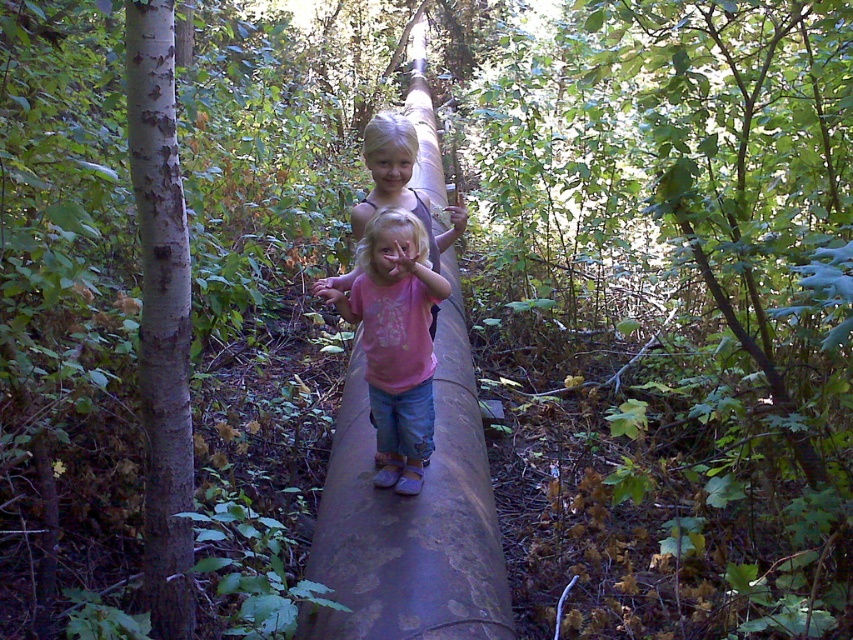
Question: Where is rusty metal log at center located in relation to white rough bark at left in the image?

Choices:
 (A) below
 (B) above

Answer: (B)

Question: Which point is closer to the camera?

Choices:
 (A) (361, 220)
 (B) (178, 305)

Answer: (B)

Question: Which object is positioned farthest from the matte pink shirt at center?

Choices:
 (A) white rough bark at left
 (B) rusty metal log at center

Answer: (B)

Question: In this image, where is rusty metal log at center located relative to white rough bark at left?

Choices:
 (A) right
 (B) left

Answer: (A)

Question: Does white rough bark at left have a larger size compared to matte pink shirt at center?

Choices:
 (A) no
 (B) yes

Answer: (A)

Question: Which object appears closest to the camera in this image?

Choices:
 (A) matte pink shirt at center
 (B) rusty metal log at center

Answer: (B)